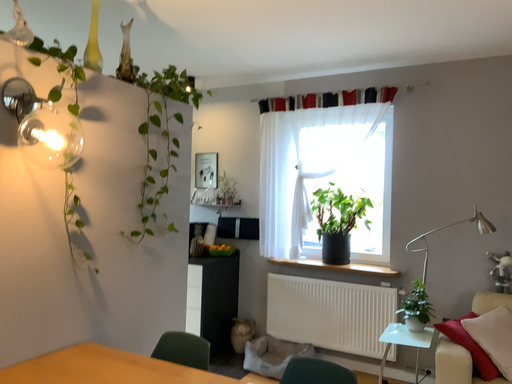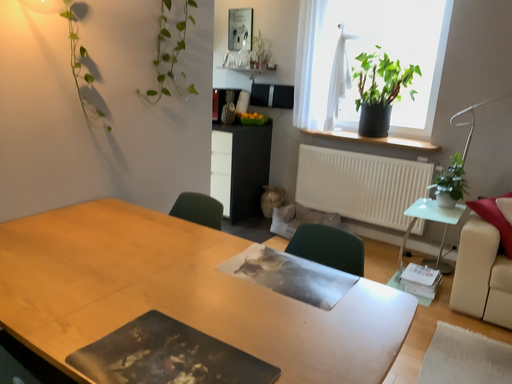
Question: Which way did the camera rotate in the video?

Choices:
 (A) rotated downward
 (B) rotated upward

Answer: (A)